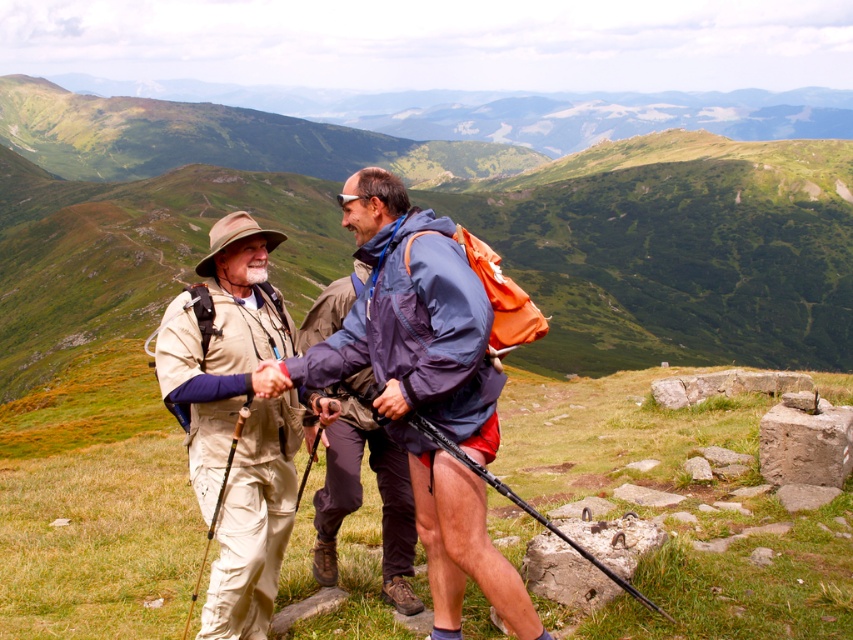
Question: Where is beige fabric hat at center located in relation to matte blue jacket at center in the image?

Choices:
 (A) left
 (B) right

Answer: (A)

Question: Which object is positioned farthest from the khaki cotton pants at center?

Choices:
 (A) matte blue jacket at center
 (B) beige fabric hat at center

Answer: (A)

Question: Considering the real-world distances, which object is farthest from the khaki cotton pants at center?

Choices:
 (A) beige fabric hat at center
 (B) matte blue jacket at center

Answer: (B)

Question: Can you confirm if khaki cotton pants at center is thinner than matte blue jacket at center?

Choices:
 (A) no
 (B) yes

Answer: (A)

Question: Which object is closer to the camera taking this photo?

Choices:
 (A) matte blue jacket at center
 (B) khaki cotton pants at center
 (C) beige fabric hat at center

Answer: (B)

Question: Can you confirm if khaki cotton pants at center is positioned above beige fabric hat at center?

Choices:
 (A) yes
 (B) no

Answer: (A)